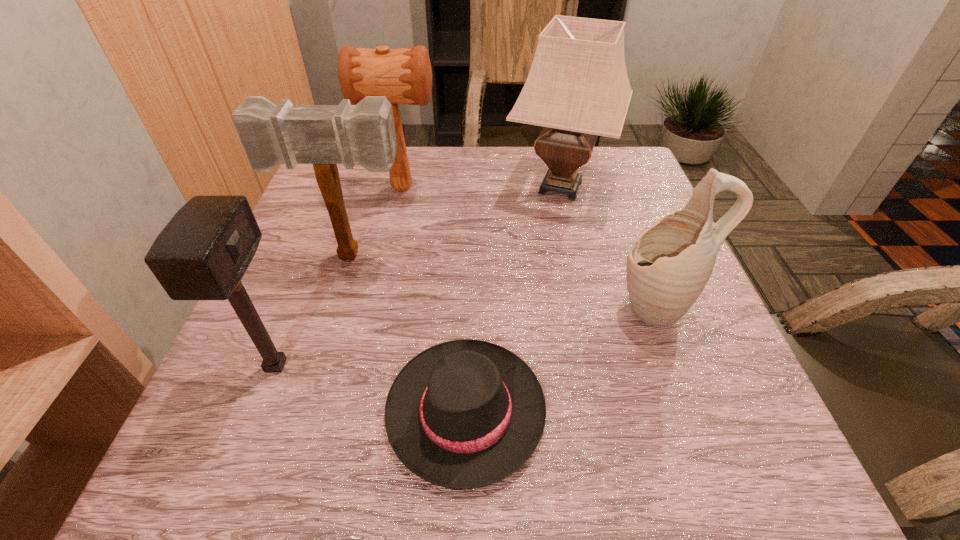
Where is `lampshade`? lampshade is located at coordinates (578, 88).

Find the location of a particular element. The height and width of the screenshot is (540, 960). the farthest mallet is located at coordinates (404, 76).

Locate an element on the screen. This screenshot has height=540, width=960. the second nearest mallet is located at coordinates (323, 135).

At what (x,y) coordinates should I click in order to perform the action: click on the nearest mallet. Please return your answer as a coordinate pair (x, y). Image resolution: width=960 pixels, height=540 pixels. Looking at the image, I should click on (203, 252).

The image size is (960, 540). Identify the location of pitcher. (670, 263).

This screenshot has height=540, width=960. I want to click on the shortest object, so click(463, 414).

In order to click on vacant space located on the left of the lampshade in this screenshot , I will do `click(373, 187)`.

Where is `vacant region located on the strike surface of the farthest mallet`? vacant region located on the strike surface of the farthest mallet is located at coordinates (472, 188).

Locate an element on the screen. This screenshot has height=540, width=960. vacant space situated 0.060m on the right of the second nearest mallet is located at coordinates (439, 255).

This screenshot has height=540, width=960. In order to click on vacant space located on the back of the nearest mallet in this screenshot , I will do `click(298, 309)`.